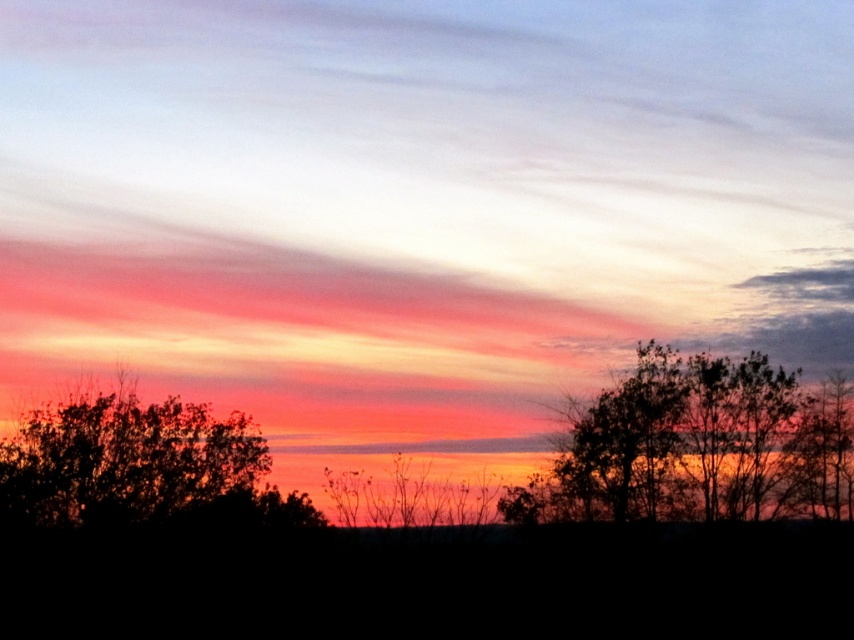
Question: Is the position of silhouette leafy tree at right less distant than that of silhouette tree at left?

Choices:
 (A) yes
 (B) no

Answer: (B)

Question: Observing the image, what is the correct spatial positioning of silhouette leafy tree at right in reference to silhouette tree at left?

Choices:
 (A) left
 (B) right

Answer: (B)

Question: Which object appears closest to the camera in this image?

Choices:
 (A) silhouette tree at left
 (B) silhouette leafy tree at right

Answer: (A)

Question: Is silhouette leafy tree at right positioned before silhouette tree at left?

Choices:
 (A) no
 (B) yes

Answer: (A)

Question: Which object appears closest to the camera in this image?

Choices:
 (A) silhouette tree at left
 (B) silhouette leafy tree at right

Answer: (A)